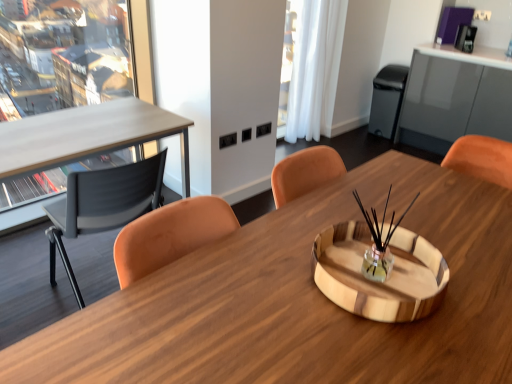
Question: Is black matte trash bin/can at right shorter than wooden desk at center?

Choices:
 (A) yes
 (B) no

Answer: (A)

Question: Considering the relative sizes of black matte trash bin/can at right and wooden desk at center in the image provided, is black matte trash bin/can at right thinner than wooden desk at center?

Choices:
 (A) yes
 (B) no

Answer: (A)

Question: Is black matte trash bin/can at right bigger than wooden desk at center?

Choices:
 (A) yes
 (B) no

Answer: (B)

Question: Is black matte trash bin/can at right taller than wooden desk at center?

Choices:
 (A) yes
 (B) no

Answer: (B)

Question: Is black matte trash bin/can at right smaller than wooden desk at center?

Choices:
 (A) yes
 (B) no

Answer: (A)

Question: Is black matte trash bin/can at right looking in the opposite direction of wooden desk at center?

Choices:
 (A) no
 (B) yes

Answer: (A)

Question: Is black matte trash bin/can at right further to the viewer compared to matte black chair at left?

Choices:
 (A) yes
 (B) no

Answer: (A)

Question: Can matte black chair at left be found inside black matte trash bin/can at right?

Choices:
 (A) yes
 (B) no

Answer: (B)

Question: Is black matte trash bin/can at right bigger than matte black chair at left?

Choices:
 (A) yes
 (B) no

Answer: (B)

Question: From the image's perspective, is black matte trash bin/can at right on matte black chair at left?

Choices:
 (A) yes
 (B) no

Answer: (A)

Question: Can you confirm if black matte trash bin/can at right is smaller than matte black chair at left?

Choices:
 (A) yes
 (B) no

Answer: (A)

Question: Does black matte trash bin/can at right appear on the right side of matte black chair at left?

Choices:
 (A) no
 (B) yes

Answer: (B)

Question: From the image's perspective, would you say white sheer curtain at upper right is shown under wooden desk at center?

Choices:
 (A) yes
 (B) no

Answer: (B)